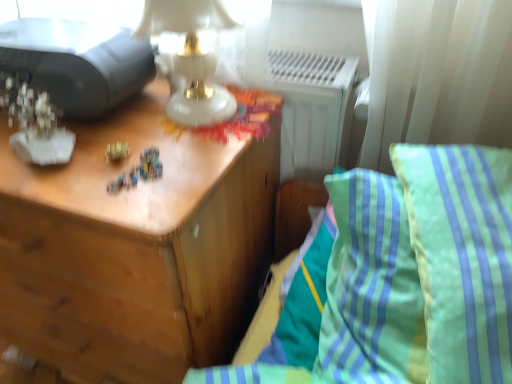
Locate an element on the screen. This screenshot has height=384, width=512. empty space that is ontop of wooden nightstand at left (from a real-world perspective) is located at coordinates (131, 138).